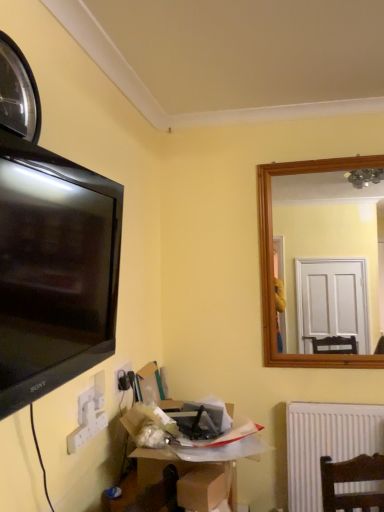
Question: Can you confirm if brown cardboard box at lower center, which is the second cardboard box in back-to-front order, is shorter than cardboard box at lower center, which appears as the 1th cardboard box when viewed from the back?

Choices:
 (A) no
 (B) yes

Answer: (B)

Question: From a real-world perspective, is brown cardboard box at lower center, which is the second cardboard box in back-to-front order, on top of cardboard box at lower center, the second cardboard box from the front?

Choices:
 (A) no
 (B) yes

Answer: (A)

Question: Does brown cardboard box at lower center, which is the second cardboard box in back-to-front order, have a lesser width compared to cardboard box at lower center, which appears as the 1th cardboard box when viewed from the back?

Choices:
 (A) no
 (B) yes

Answer: (B)

Question: Does brown cardboard box at lower center, which is the second cardboard box in back-to-front order, have a greater height compared to cardboard box at lower center, the second cardboard box from the front?

Choices:
 (A) yes
 (B) no

Answer: (B)

Question: Is brown cardboard box at lower center, which is the second cardboard box in back-to-front order, placed right next to cardboard box at lower center, the second cardboard box from the front?

Choices:
 (A) yes
 (B) no

Answer: (A)

Question: Choose the correct answer: Is white ribbed radiator at lower right inside brown cardboard box at lower center, which is the second cardboard box in back-to-front order, or outside it?

Choices:
 (A) inside
 (B) outside

Answer: (B)

Question: Considering the positions of point (311, 445) and point (201, 492), is point (311, 445) closer or farther from the camera than point (201, 492)?

Choices:
 (A) farther
 (B) closer

Answer: (A)

Question: Would you say white ribbed radiator at lower right is to the left or to the right of brown cardboard box at lower center, the first cardboard box positioned from the front, in the picture?

Choices:
 (A) left
 (B) right

Answer: (B)

Question: Is white ribbed radiator at lower right in front of or behind brown cardboard box at lower center, which is the second cardboard box in back-to-front order, in the image?

Choices:
 (A) behind
 (B) front

Answer: (A)

Question: Relative to matte black tv at left, is white plastic electric outlet at lower left in front or behind?

Choices:
 (A) behind
 (B) front

Answer: (A)

Question: Is white plastic electric outlet at lower left inside the boundaries of matte black tv at left, or outside?

Choices:
 (A) inside
 (B) outside

Answer: (B)

Question: From a real-world perspective, is white plastic electric outlet at lower left positioned above or below matte black tv at left?

Choices:
 (A) below
 (B) above

Answer: (A)

Question: In terms of height, does white plastic electric outlet at lower left look taller or shorter compared to matte black tv at left?

Choices:
 (A) tall
 (B) short

Answer: (B)

Question: Is cardboard box at lower center, which appears as the 1th cardboard box when viewed from the back, spatially inside matte black tv at left, or outside of it?

Choices:
 (A) outside
 (B) inside

Answer: (A)

Question: Considering the positions of cardboard box at lower center, which appears as the 1th cardboard box when viewed from the back, and matte black tv at left in the image, is cardboard box at lower center, which appears as the 1th cardboard box when viewed from the back, taller or shorter than matte black tv at left?

Choices:
 (A) short
 (B) tall

Answer: (A)